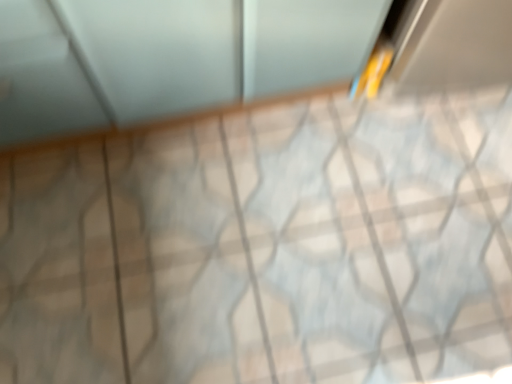
Find the location of a particular element. This screenshot has width=512, height=384. matte glass screen door at upper center is located at coordinates point(213,49).

Describe the element at coordinates (213, 49) in the screenshot. I see `matte glass screen door at upper center` at that location.

Image resolution: width=512 pixels, height=384 pixels. Find the location of `matte glass screen door at upper center`. matte glass screen door at upper center is located at coordinates (213, 49).